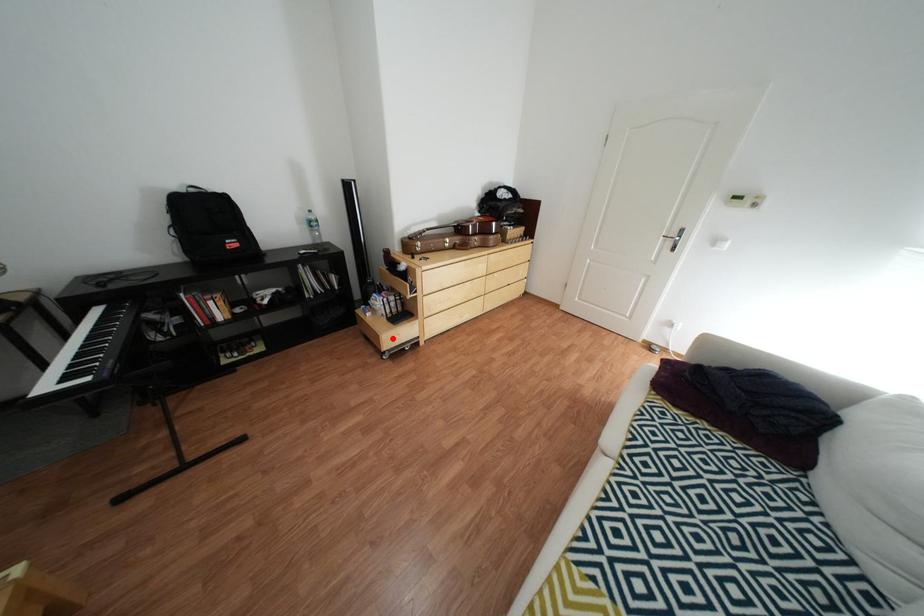
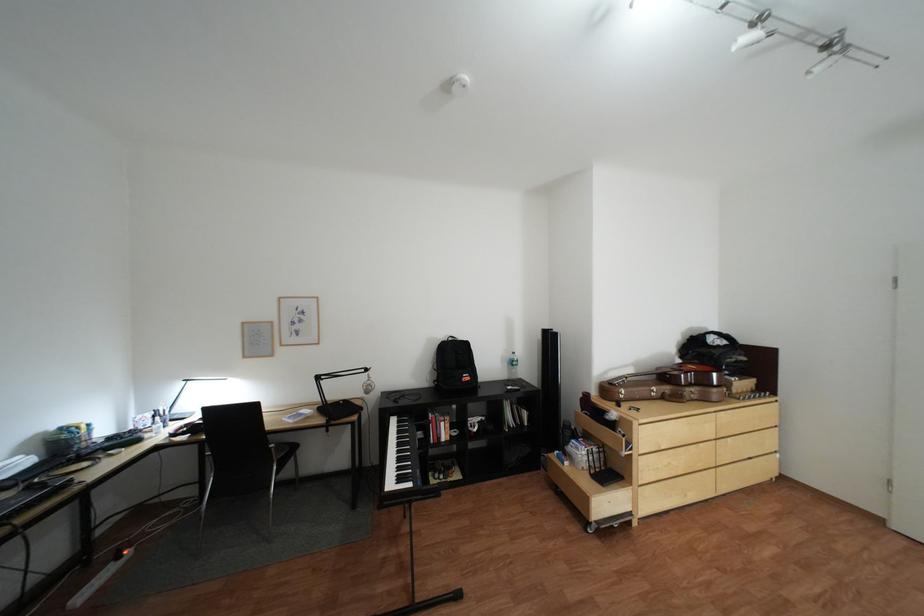
Where in the second image is the point corresponding to the highlighted location from the first image?

(602, 500)